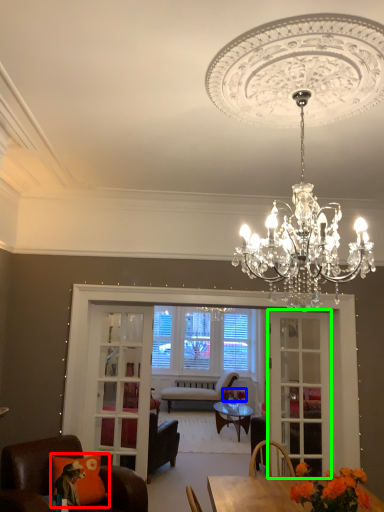
Question: Considering the real-world distances, which object is farthest from pillow (highlighted by a red box)? flower (highlighted by a blue box) or screen door (highlighted by a green box)?

Choices:
 (A) flower
 (B) screen door

Answer: (A)